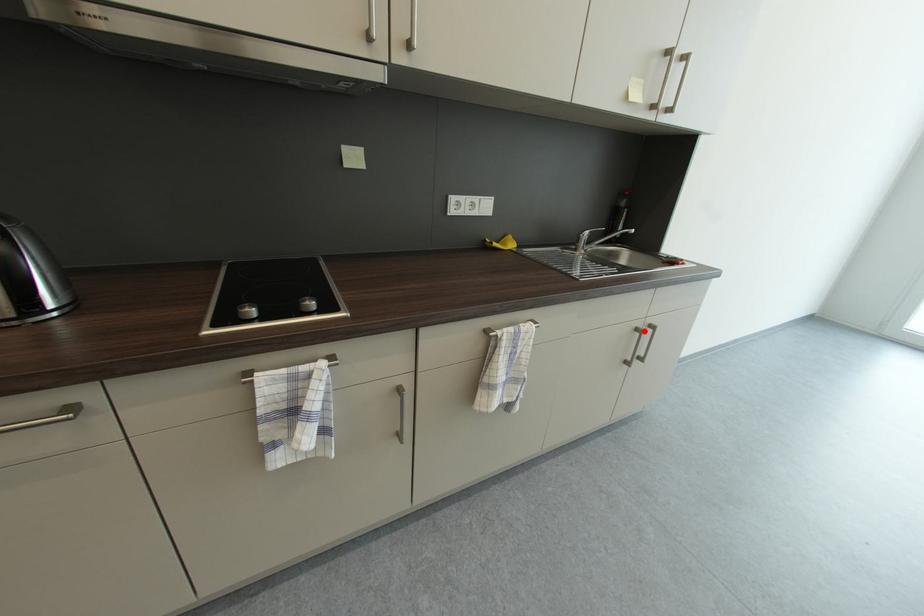
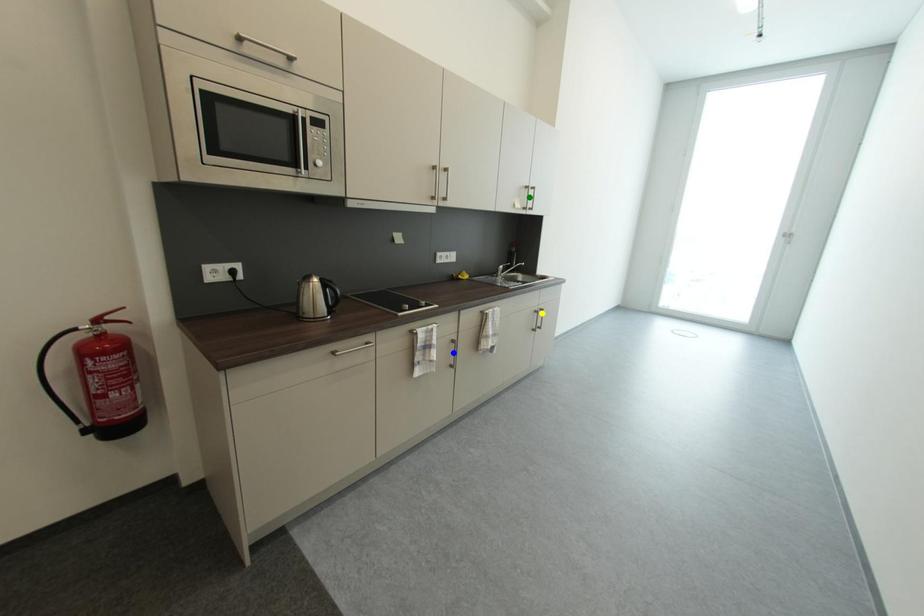
Question: I am providing you with two images of the same scene from different viewpoints. A red point is marked on the first image. You are given multiple points on the second image. Can you choose the point in image 2 that corresponds to the point in image 1?

Choices:
 (A) green point
 (B) yellow point
 (C) blue point

Answer: (B)